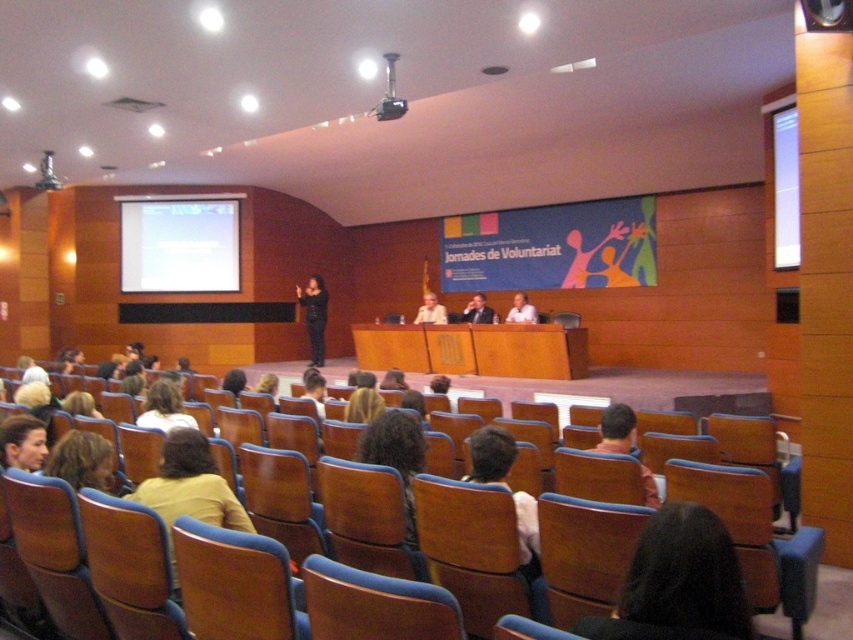
Is point (242, 637) less distant than point (610, 420)?

That is True.

Can you confirm if brown wood chair at lower left is shorter than orange fabric shirt at center?

Result: Correct, brown wood chair at lower left is not as tall as orange fabric shirt at center.

Describe the element at coordinates (234, 584) in the screenshot. I see `brown wood chair at lower left` at that location.

Where is `brown wood chair at lower left`? The height and width of the screenshot is (640, 853). brown wood chair at lower left is located at coordinates (234, 584).

Is point (410, 522) positioned behind point (315, 330)?

No, it is in front of (315, 330).

Measure the distance from curly hair at center to matte black dress at center.

curly hair at center and matte black dress at center are 31.17 feet apart from each other.

Find the location of a particular element. curly hair at center is located at coordinates (396, 456).

From the picture: Is blue fabric chair at lower center to the right of curly hair at center from the viewer's perspective?

Correct, you'll find blue fabric chair at lower center to the right of curly hair at center.

Is blue fabric chair at lower center above curly hair at center?

No.

Does point (434, 593) lie in front of point (410, 467)?

Yes, it is.

I want to click on blue fabric chair at lower center, so click(374, 604).